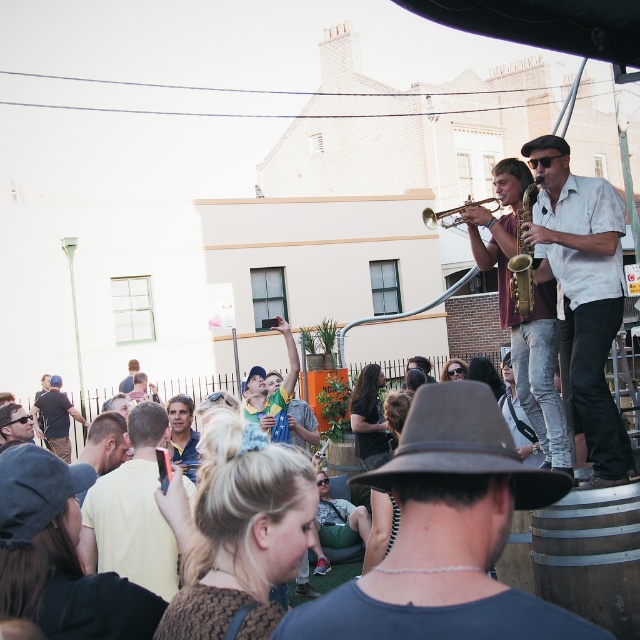
Which is above, yellow-green shirt at center or gold brass trumpet at center?

gold brass trumpet at center is above.

You are a GUI agent. You are given a task and a screenshot of the screen. Output one action in this format:
    pyautogui.click(x=<x>, y=<y>)
    Task: Click on the yellow-green shirt at center
    Image resolution: width=640 pixels, height=640 pixels.
    Given the screenshot: What is the action you would take?
    pyautogui.click(x=266, y=385)

Is point (515, 291) less distant than point (422, 211)?

Yes, point (515, 291) is in front of point (422, 211).

Is gold brass trumpet at center to the left of gold metallic trumpet at upper center from the viewer's perspective?

Correct, you'll find gold brass trumpet at center to the left of gold metallic trumpet at upper center.

Describe the element at coordinates (522, 259) in the screenshot. I see `gold brass trumpet at center` at that location.

Image resolution: width=640 pixels, height=640 pixels. Identify the location of gold brass trumpet at center. (522, 259).

Can you confirm if wooden barrel at lower right is wider than dark blue shirt at lower left?

No, wooden barrel at lower right is not wider than dark blue shirt at lower left.

Between wooden barrel at lower right and dark blue shirt at lower left, which one is positioned lower?

dark blue shirt at lower left is lower down.

Does point (589, 547) lie behind point (58, 452)?

That is False.

Locate an element on the screen. This screenshot has width=640, height=640. wooden barrel at lower right is located at coordinates (589, 556).